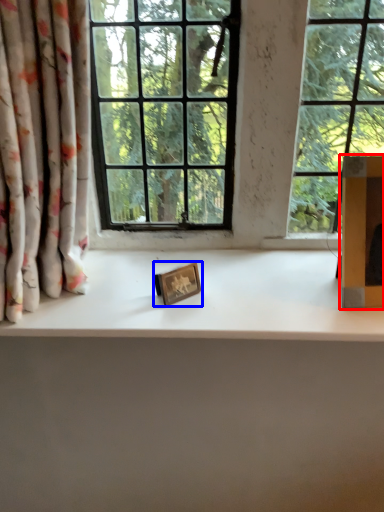
Question: Which object is further to the camera taking this photo, cardboard box (highlighted by a red box) or picture frame (highlighted by a blue box)?

Choices:
 (A) cardboard box
 (B) picture frame

Answer: (B)